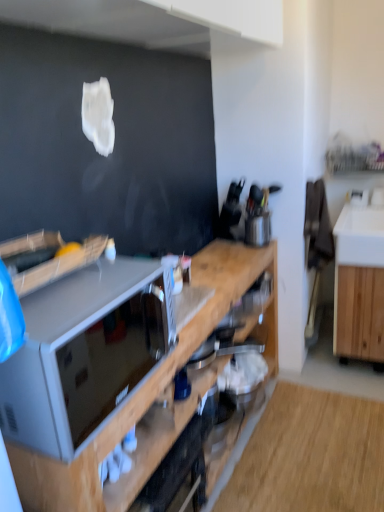
Question: Should I look upward or downward to see wooden cabinet at right, positioned as the 2th cabinetry in left-to-right order?

Choices:
 (A) down
 (B) up

Answer: (A)

Question: Is metallic silver toaster at center, which is counted as the 1th appliance, starting from the left, directly adjacent to wooden cabinet at right, positioned as the 2th cabinetry in left-to-right order?

Choices:
 (A) no
 (B) yes

Answer: (A)

Question: Is metallic silver toaster at center, the first appliance from the front, thinner than wooden cabinet at right, the 1th cabinetry viewed from the right?

Choices:
 (A) no
 (B) yes

Answer: (B)

Question: From a real-world perspective, does metallic silver toaster at center, which is counted as the 1th appliance, starting from the left, stand above wooden cabinet at right, positioned as the 2th cabinetry in left-to-right order?

Choices:
 (A) yes
 (B) no

Answer: (A)

Question: Is metallic silver toaster at center, the first appliance from the front, not inside wooden cabinet at right, the 1th cabinetry viewed from the right?

Choices:
 (A) yes
 (B) no

Answer: (A)

Question: Does metallic silver toaster at center, which is counted as the 1th appliance, starting from the left, have a lesser height compared to wooden cabinet at right, positioned as the 2th cabinetry in left-to-right order?

Choices:
 (A) yes
 (B) no

Answer: (A)

Question: Is metallic silver toaster at center, which is counted as the 1th appliance, starting from the left, wider than wooden cabinet at right, positioned as the 2th cabinetry in left-to-right order?

Choices:
 (A) no
 (B) yes

Answer: (A)

Question: From a real-world perspective, is matte gray microwave at center positioned over wooden cabinet at right, the 1th cabinetry viewed from the right, based on gravity?

Choices:
 (A) no
 (B) yes

Answer: (B)

Question: Does matte gray microwave at center have a smaller size compared to wooden cabinet at right, positioned as the 2th cabinetry in left-to-right order?

Choices:
 (A) no
 (B) yes

Answer: (B)

Question: Is the depth of matte gray microwave at center less than that of wooden cabinet at right, the 1th cabinetry viewed from the right?

Choices:
 (A) no
 (B) yes

Answer: (B)

Question: Can wooden cabinet at right, the 1th cabinetry viewed from the right, be found inside matte gray microwave at center?

Choices:
 (A) no
 (B) yes

Answer: (A)

Question: Is matte gray microwave at center not near wooden cabinet at right, positioned as the 2th cabinetry in left-to-right order?

Choices:
 (A) yes
 (B) no

Answer: (A)

Question: Is matte gray microwave at center positioned beyond the bounds of wooden cabinet at right, positioned as the 2th cabinetry in left-to-right order?

Choices:
 (A) no
 (B) yes

Answer: (B)

Question: Could you tell me if wooden cabinet at right, positioned as the 2th cabinetry in left-to-right order, is turned towards wooden cabinet at center, placed as the second cabinetry when sorted from right to left?

Choices:
 (A) no
 (B) yes

Answer: (A)